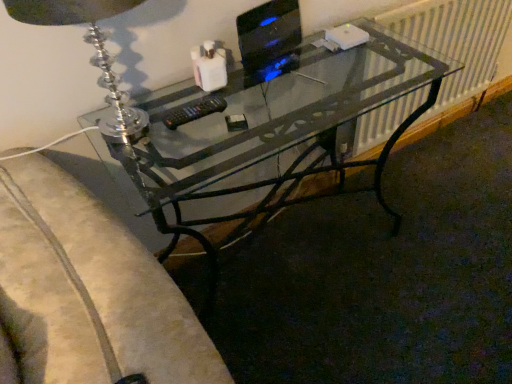
Identify the location of free space above transparent glass desk at center (from a real-world perspective). The width and height of the screenshot is (512, 384). (298, 82).